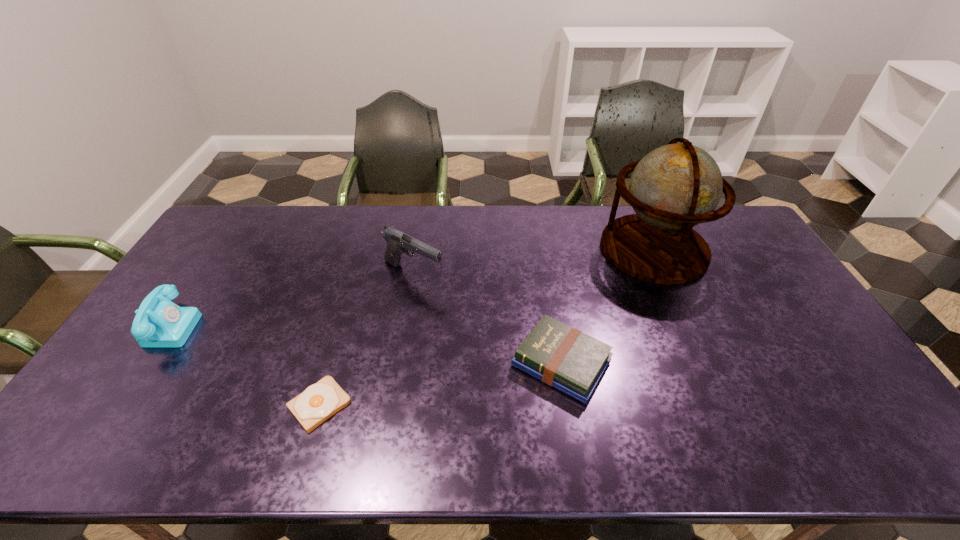
This screenshot has width=960, height=540. Identify the location of free space that is in between the fourth tallest object and the gun. (488, 319).

Locate an element on the screen. The height and width of the screenshot is (540, 960). vacant area between the gun and the globe is located at coordinates pyautogui.click(x=534, y=261).

Find the location of a particular element. Image resolution: width=960 pixels, height=540 pixels. free spot between the shortest object and the second tallest object is located at coordinates (367, 339).

Locate an element on the screen. vacant region between the book and the fourth shortest object is located at coordinates (488, 319).

Find the location of `vacant space in between the toast and the globe`. vacant space in between the toast and the globe is located at coordinates (487, 327).

Locate an element on the screen. The image size is (960, 540). free spot between the tallest object and the book is located at coordinates (608, 306).

You are a GUI agent. You are given a task and a screenshot of the screen. Output one action in this format:
    pyautogui.click(x=<x>, y=<y>)
    Task: Click on the vacant space that's between the third shortest object and the second shortest object
    The height and width of the screenshot is (540, 960).
    Given the screenshot: What is the action you would take?
    pyautogui.click(x=366, y=344)

This screenshot has width=960, height=540. Find the location of `free point between the rightmost object and the shortest object`. free point between the rightmost object and the shortest object is located at coordinates (487, 327).

Where is `empty location between the fourth tallest object and the telephone`? empty location between the fourth tallest object and the telephone is located at coordinates (366, 344).

Image resolution: width=960 pixels, height=540 pixels. In order to click on vacant region between the shortest object and the third shortest object in this screenshot , I will do `click(245, 365)`.